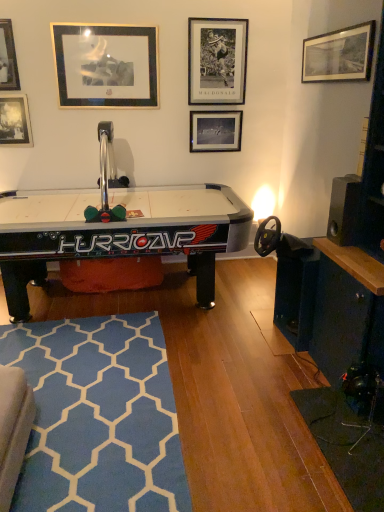
This screenshot has width=384, height=512. In order to click on empty space that is in between black glossy air hockey table at center and blue textured rug at lower left in this screenshot , I will do `click(210, 378)`.